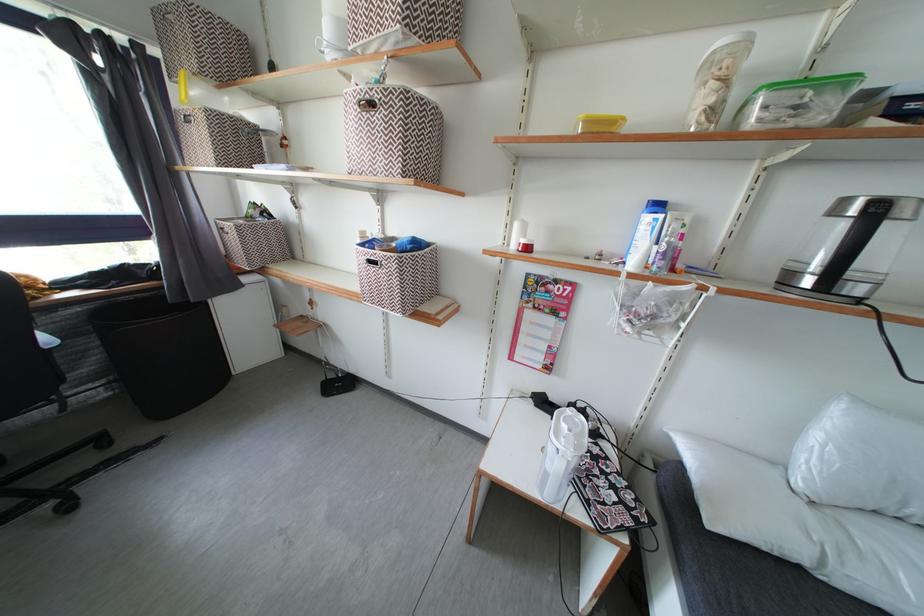
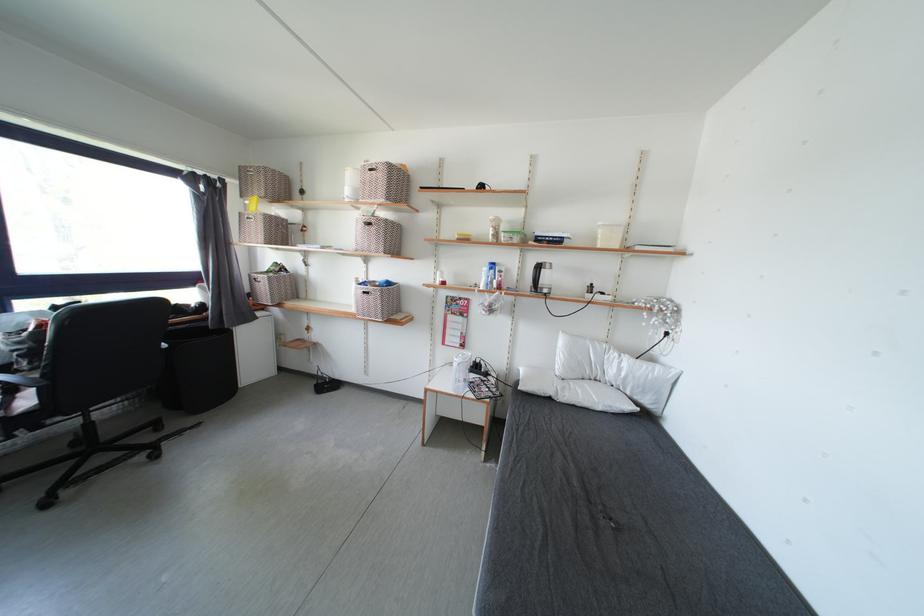
The point at (545, 371) is marked in the first image. Where is the corresponding point in the second image?

(465, 351)